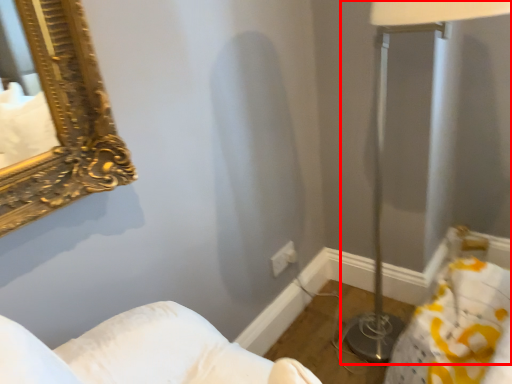
Question: From the image's perspective, what is the correct spatial relationship of table lamp (annotated by the red box) in relation to electric outlet?

Choices:
 (A) below
 (B) above

Answer: (B)